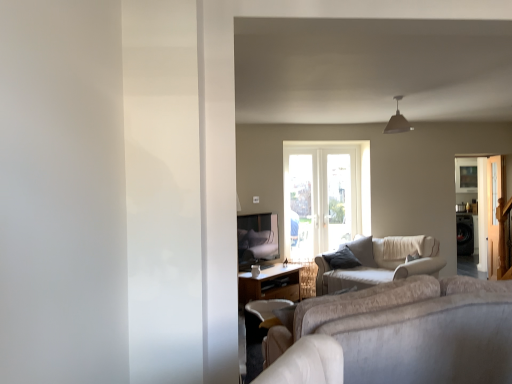
Question: Is clear glass screen door at right, the first screen door when ordered from front to back, wider than metallic silver screen door at right, which appears as the 1th screen door when viewed from the back?

Choices:
 (A) no
 (B) yes

Answer: (B)

Question: Could you tell me if clear glass screen door at right, the first screen door when ordered from front to back, is facing metallic silver screen door at right, which appears as the 1th screen door when viewed from the back?

Choices:
 (A) no
 (B) yes

Answer: (A)

Question: Is metallic silver screen door at right, which appears as the 1th screen door when viewed from the back, at the back of clear glass screen door at right, the second screen door from the back?

Choices:
 (A) yes
 (B) no

Answer: (B)

Question: From the image's perspective, does clear glass screen door at right, the first screen door when ordered from front to back, appear lower than metallic silver screen door at right, which is the 2th screen door in front-to-back order?

Choices:
 (A) yes
 (B) no

Answer: (B)

Question: Is clear glass screen door at right, the second screen door from the back, not near metallic silver screen door at right, which appears as the 1th screen door when viewed from the back?

Choices:
 (A) no
 (B) yes

Answer: (A)

Question: From a real-world perspective, is clear glass screen door at right, the second screen door from the back, beneath metallic silver screen door at right, which appears as the 1th screen door when viewed from the back?

Choices:
 (A) no
 (B) yes

Answer: (A)

Question: Does beige fabric couch at center lie in front of dark brown leather swivel chair at lower center?

Choices:
 (A) yes
 (B) no

Answer: (A)

Question: Is beige fabric couch at center to the right of dark brown leather swivel chair at lower center from the viewer's perspective?

Choices:
 (A) yes
 (B) no

Answer: (A)

Question: Is beige fabric couch at center touching dark brown leather swivel chair at lower center?

Choices:
 (A) yes
 (B) no

Answer: (B)

Question: Is beige fabric couch at center at the left side of dark brown leather swivel chair at lower center?

Choices:
 (A) no
 (B) yes

Answer: (A)

Question: Does beige fabric couch at center turn towards dark brown leather swivel chair at lower center?

Choices:
 (A) yes
 (B) no

Answer: (A)

Question: Does beige fabric couch at center have a lesser width compared to dark brown leather swivel chair at lower center?

Choices:
 (A) yes
 (B) no

Answer: (B)

Question: Can you confirm if beige fabric couch at center is positioned to the left of clear glass screen door at right, the second screen door from the back?

Choices:
 (A) yes
 (B) no

Answer: (A)